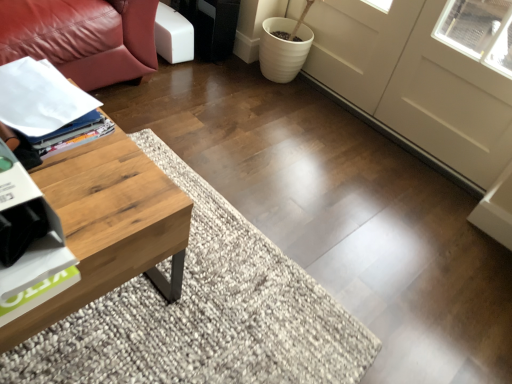
Question: Is white matte screen door at center at the right side of white glossy magazine at left?

Choices:
 (A) yes
 (B) no

Answer: (A)

Question: Is white matte screen door at center oriented towards white glossy magazine at left?

Choices:
 (A) yes
 (B) no

Answer: (A)

Question: Does white matte screen door at center contain white glossy magazine at left?

Choices:
 (A) yes
 (B) no

Answer: (B)

Question: From the image's perspective, is white matte screen door at center beneath white glossy magazine at left?

Choices:
 (A) no
 (B) yes

Answer: (A)

Question: Can you confirm if white matte screen door at center is taller than white glossy magazine at left?

Choices:
 (A) no
 (B) yes

Answer: (B)

Question: Considering their positions, is white matte screen door at center located in front of or behind white glossy magazine at left?

Choices:
 (A) behind
 (B) front

Answer: (A)

Question: From the image's perspective, relative to white glossy magazine at left, is white matte screen door at center above or below?

Choices:
 (A) above
 (B) below

Answer: (A)

Question: Considering the positions of white matte screen door at center and white glossy magazine at left in the image, is white matte screen door at center taller or shorter than white glossy magazine at left?

Choices:
 (A) short
 (B) tall

Answer: (B)

Question: Does point (389, 11) appear closer or farther from the camera than point (70, 99)?

Choices:
 (A) closer
 (B) farther

Answer: (B)

Question: Is woodenmaterial/texturecoffee table at left bigger or smaller than white matte screen door at center?

Choices:
 (A) small
 (B) big

Answer: (B)

Question: In the image, is woodenmaterial/texturecoffee table at left on the left side or the right side of white matte screen door at center?

Choices:
 (A) left
 (B) right

Answer: (A)

Question: From a real-world perspective, relative to white matte screen door at center, is woodenmaterial/texturecoffee table at left vertically above or below?

Choices:
 (A) below
 (B) above

Answer: (A)

Question: Do you think woodenmaterial/texturecoffee table at left is within white matte screen door at center, or outside of it?

Choices:
 (A) outside
 (B) inside

Answer: (A)

Question: Which is correct: white glossy magazine at left is inside white matte screen door at center, or outside of it?

Choices:
 (A) outside
 (B) inside

Answer: (A)

Question: Is white glossy magazine at left in front of or behind white matte screen door at center in the image?

Choices:
 (A) behind
 (B) front

Answer: (B)